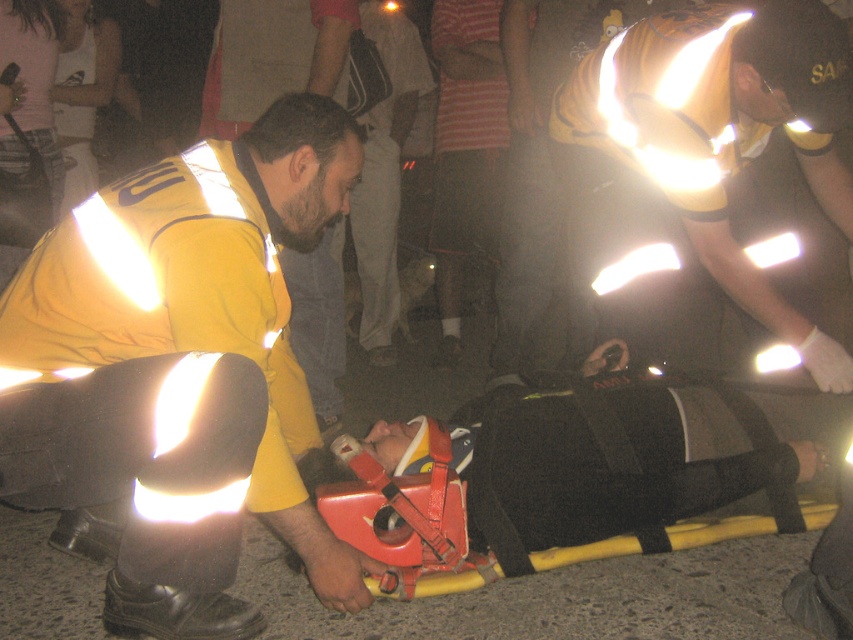
You are a bystander at the scene and need to quickly identify which emergency worker is closer to the stretcher. According to the image, which object is positioned closer to the stretcher between the matte yellow uniform at center and the reflective yellow vest at center?

The matte yellow uniform at center is much taller than the reflective yellow vest at center, so the reflective yellow vest at center is positioned closer to the stretcher.

You are a photographer at the scene. You need to capture a clear shot of both the matte yellow uniform at center and the reflective yellow vest at center. Based on their positions, which one will appear lower in the photo?

The matte yellow uniform at center is located below the reflective yellow vest at center, so it will appear lower in the photo.

Consider the image. You are a bystander at the scene and want to identify which emergency worker is closer to you. You see a matte yellow uniform at center and a reflective yellow vest at center. Which one is closer to you?

The matte yellow uniform at center is closer to you because it is in front of the reflective yellow vest at center.